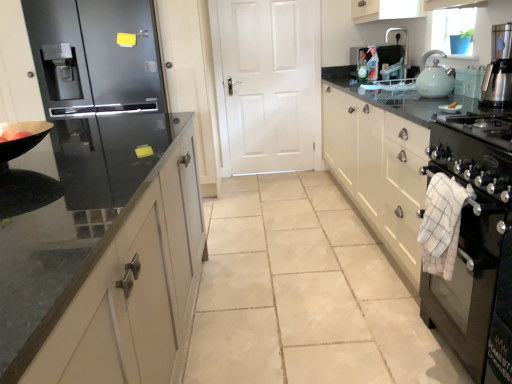
Question: Can matte orange tomato at left be found inside white matte door at center?

Choices:
 (A) no
 (B) yes

Answer: (A)

Question: From the image's perspective, is white matte door at center on top of matte orange tomato at left?

Choices:
 (A) yes
 (B) no

Answer: (A)

Question: Is white matte door at center in front of matte orange tomato at left?

Choices:
 (A) yes
 (B) no

Answer: (B)

Question: Is white matte door at center facing away from matte orange tomato at left?

Choices:
 (A) yes
 (B) no

Answer: (B)

Question: Are white matte door at center and matte orange tomato at left beside each other?

Choices:
 (A) yes
 (B) no

Answer: (B)

Question: From the image's perspective, is white matte door at center under matte orange tomato at left?

Choices:
 (A) yes
 (B) no

Answer: (B)

Question: Is white checkered towel at right far from black glass stove at right?

Choices:
 (A) yes
 (B) no

Answer: (B)

Question: Considering the relative positions of white checkered towel at right and black glass stove at right in the image provided, is white checkered towel at right to the right of black glass stove at right from the viewer's perspective?

Choices:
 (A) no
 (B) yes

Answer: (A)

Question: Is white checkered towel at right positioned beyond the bounds of black glass stove at right?

Choices:
 (A) yes
 (B) no

Answer: (A)

Question: Does white checkered towel at right have a larger size compared to black glass stove at right?

Choices:
 (A) no
 (B) yes

Answer: (A)

Question: Is white checkered towel at right closer to camera compared to black glass stove at right?

Choices:
 (A) yes
 (B) no

Answer: (B)

Question: Is white checkered towel at right next to black glass stove at right and touching it?

Choices:
 (A) no
 (B) yes

Answer: (A)

Question: Is white checkered towel at right positioned beyond the bounds of black glossy countertop at right?

Choices:
 (A) yes
 (B) no

Answer: (A)